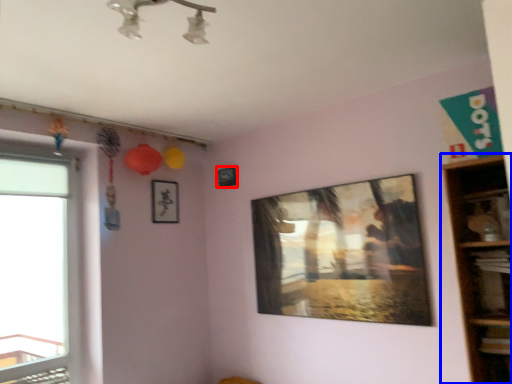
Question: Which object appears closest to the camera in this image, picture frame (highlighted by a red box) or shelf (highlighted by a blue box)?

Choices:
 (A) picture frame
 (B) shelf

Answer: (B)